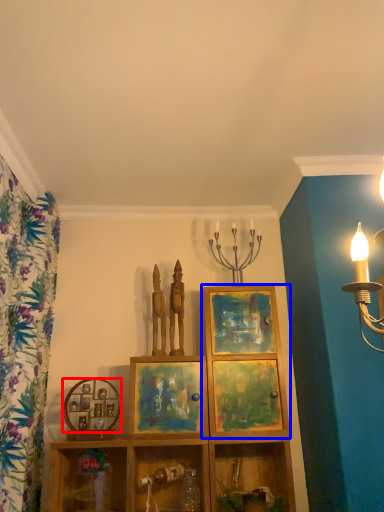
Question: Which object appears farthest to the camera in this image, picture frame (highlighted by a red box) or cabinet (highlighted by a blue box)?

Choices:
 (A) picture frame
 (B) cabinet

Answer: (A)